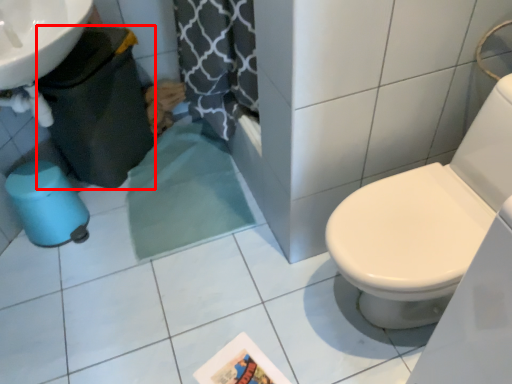
Question: Observing the image, what is the correct spatial positioning of potty (annotated by the red box) in reference to potty?

Choices:
 (A) right
 (B) left

Answer: (A)